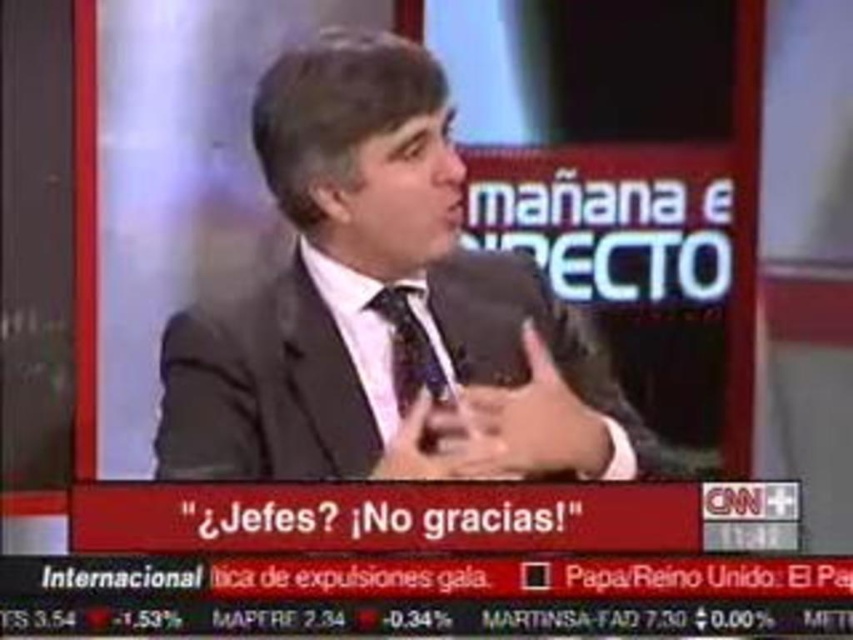
Question: Which point appears farthest from the camera in this image?

Choices:
 (A) (404, 385)
 (B) (608, 376)

Answer: (B)

Question: Which point is farther to the camera?

Choices:
 (A) (432, 364)
 (B) (428, 156)

Answer: (A)

Question: Does matte black suit at center come behind patterned silk tie at center?

Choices:
 (A) no
 (B) yes

Answer: (A)

Question: Does matte black suit at center appear on the left side of patterned silk tie at center?

Choices:
 (A) no
 (B) yes

Answer: (B)

Question: Observing the image, what is the correct spatial positioning of matte black suit at center in reference to patterned silk tie at center?

Choices:
 (A) below
 (B) above

Answer: (A)